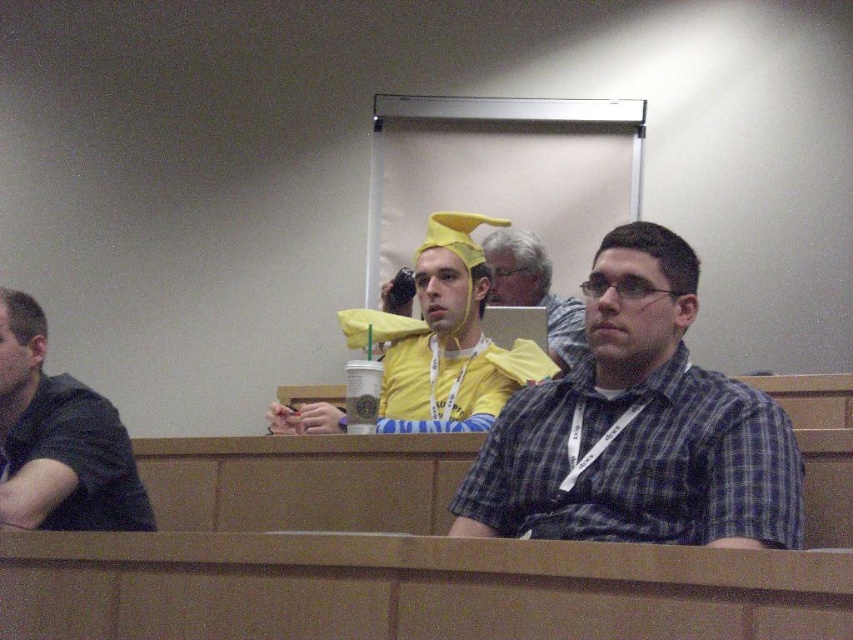
You are standing in the lecture hall and see a point marked at coordinates [637,428]. According to the image, which object is this point located on?

The point at [637,428] is located on the plaid shirt at center.

You are a photographer in the lecture hall and want to take a photo of the plaid shirt at center and dark gray shirt at left. Which one is positioned higher in the frame?

The plaid shirt at center is located above the dark gray shirt at left, so it is positioned higher in the frame.

You are standing at the back of the lecture hall and see two points on the desk in front of you. The first point is at coordinate point (405,417) and the second is at point (9,444). Which point is closer to your current position?

Point (405,417) is further to the camera than point (9,444), so the point closer to your current position is point (9,444).